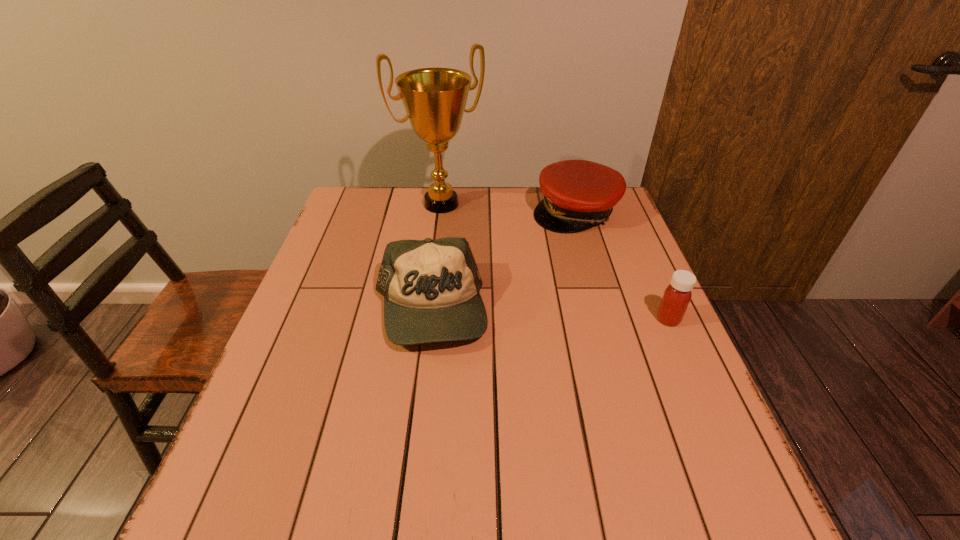
At what (x,y) coordinates should I click in order to perform the action: click on vacant space on the desktop that is between the baseball cap and the medicine and is positioned at the front of the cap where the visor is located. Please return your answer as a coordinate pair (x, y). The image size is (960, 540). Looking at the image, I should click on (580, 316).

The height and width of the screenshot is (540, 960). What are the coordinates of `vacant space on the desktop that is between the baseball cap and the medicine and is positioned on the front view with handles of the tallest object` in the screenshot? It's located at (514, 313).